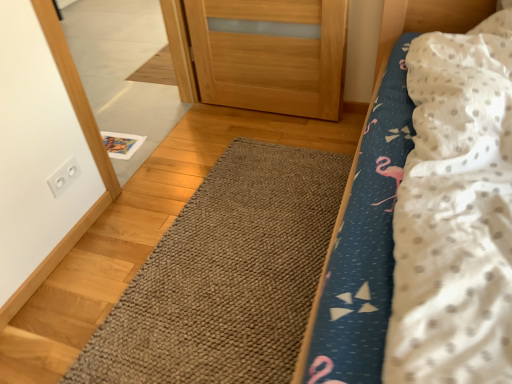
Question: From a real-world perspective, is white plastic outlet at upper left physically located above or below fluffy fabric bed at center?

Choices:
 (A) above
 (B) below

Answer: (B)

Question: Is white plastic outlet at upper left in front of or behind fluffy fabric bed at center in the image?

Choices:
 (A) behind
 (B) front

Answer: (A)

Question: Which object is positioned closest to the fluffy fabric bed at center?

Choices:
 (A) white glossy mirror at upper left
 (B) white plastic outlet at upper left
 (C) brown textured rug at center

Answer: (C)

Question: Considering the real-world distances, which object is farthest from the white glossy mirror at upper left?

Choices:
 (A) fluffy fabric bed at center
 (B) white plastic outlet at upper left
 (C) brown textured rug at center

Answer: (A)